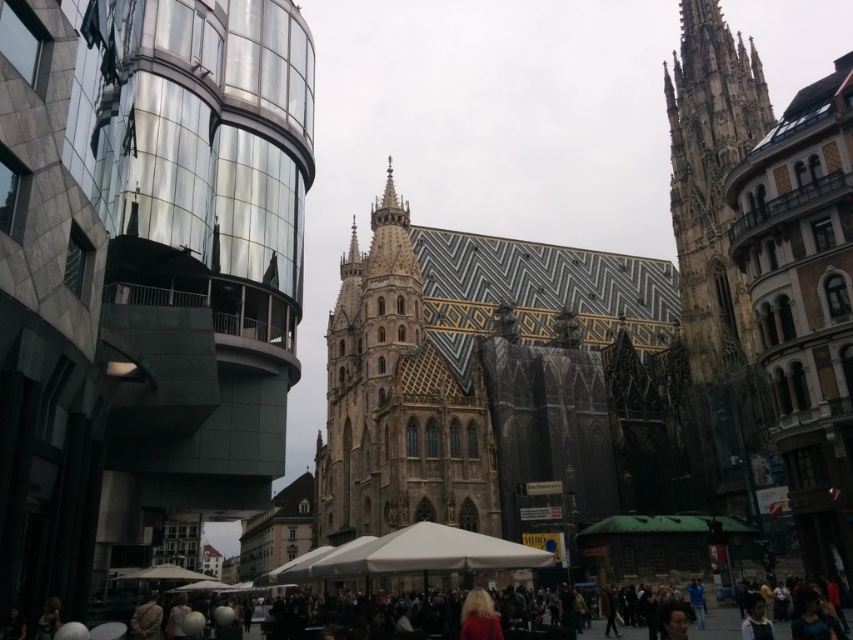
Does golden mosaic church at center have a greater height compared to golden mosaic tiles at center?

Indeed, golden mosaic church at center has a greater height compared to golden mosaic tiles at center.

Is golden mosaic church at center bigger than golden mosaic tiles at center?

Incorrect, golden mosaic church at center is not larger than golden mosaic tiles at center.

Find the location of `golden mosaic church at center`. golden mosaic church at center is located at coordinates (143, 273).

Does golden mosaic church at center come in front of dark brown leather jacket at lower center?

Yes, it is.

Which is above, golden mosaic church at center or dark brown leather jacket at lower center?

golden mosaic church at center is above.

Between point (164, 512) and point (241, 637), which one is positioned behind?

The point (164, 512) is behind.

Image resolution: width=853 pixels, height=640 pixels. I want to click on golden mosaic church at center, so click(143, 273).

Does point (700, 355) lie in front of point (395, 637)?

No, (700, 355) is behind (395, 637).

Which of these two, brown stone tower at right or dark brown leather jacket at lower center, stands taller?

With more height is brown stone tower at right.

In order to click on brown stone tower at right in this screenshot , I will do `click(715, 241)`.